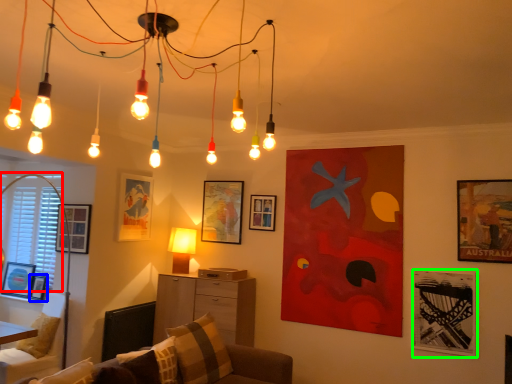
Question: Which object is positioned farthest from window screen (highlighted by a red box)? Select from picture frame (highlighted by a blue box) and picture frame (highlighted by a green box).

Choices:
 (A) picture frame
 (B) picture frame

Answer: (B)